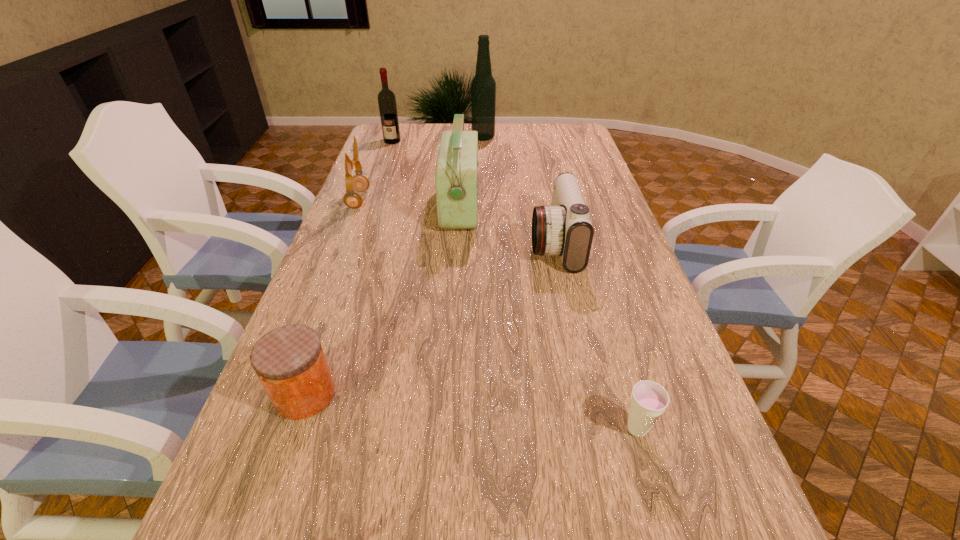
This screenshot has width=960, height=540. Identify the location of unoccupied position between the shorter alcohol and the right alcohol. (438, 139).

At what (x,y) coordinates should I click in order to perform the action: click on free space between the cup and the second shortest object. Please return your answer as a coordinate pair (x, y). This screenshot has width=960, height=540. Looking at the image, I should click on point(471,411).

Find the location of a particular element. This screenshot has width=960, height=540. free space that is in between the right alcohol and the cup is located at coordinates (560, 284).

Locate an element on the screen. Image resolution: width=960 pixels, height=540 pixels. empty location between the shorter alcohol and the second shortest object is located at coordinates (348, 268).

This screenshot has width=960, height=540. In order to click on object that is the second closest to the radio receiver in this screenshot , I will do `click(352, 199)`.

At what (x,y) coordinates should I click in order to perform the action: click on object identified as the second closest to the jar. Please return your answer as a coordinate pair (x, y). This screenshot has height=540, width=960. Looking at the image, I should click on coord(564,228).

Image resolution: width=960 pixels, height=540 pixels. What are the coordinates of `vacant space that satisfies the following two spatial constraints: 1. on the surface of the cup; 2. on the right side of the camcorder` in the screenshot? It's located at (593, 429).

Image resolution: width=960 pixels, height=540 pixels. What are the coordinates of `free region that satisfies the following two spatial constraints: 1. on the front-facing side of the cup; 2. on the left side of the earphone` in the screenshot? It's located at (268, 429).